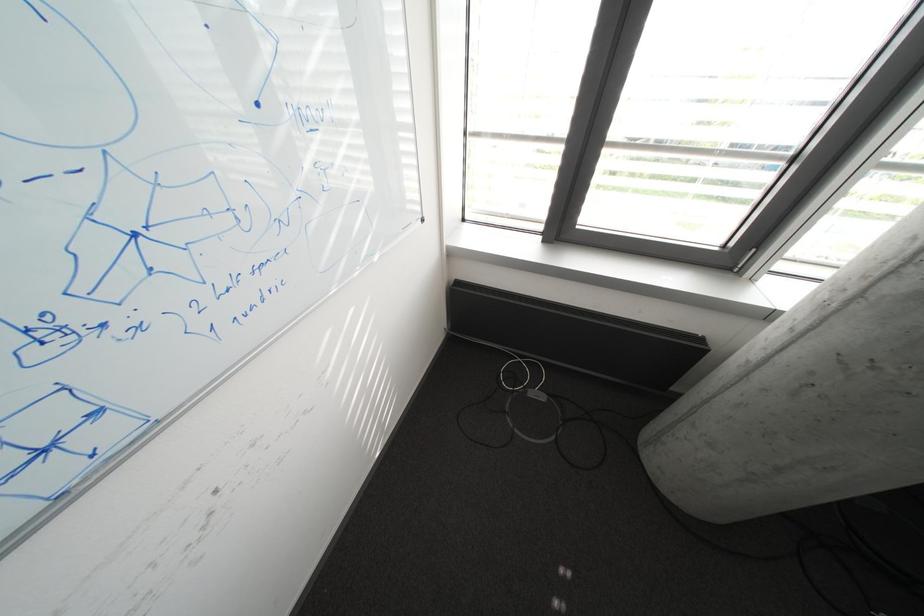
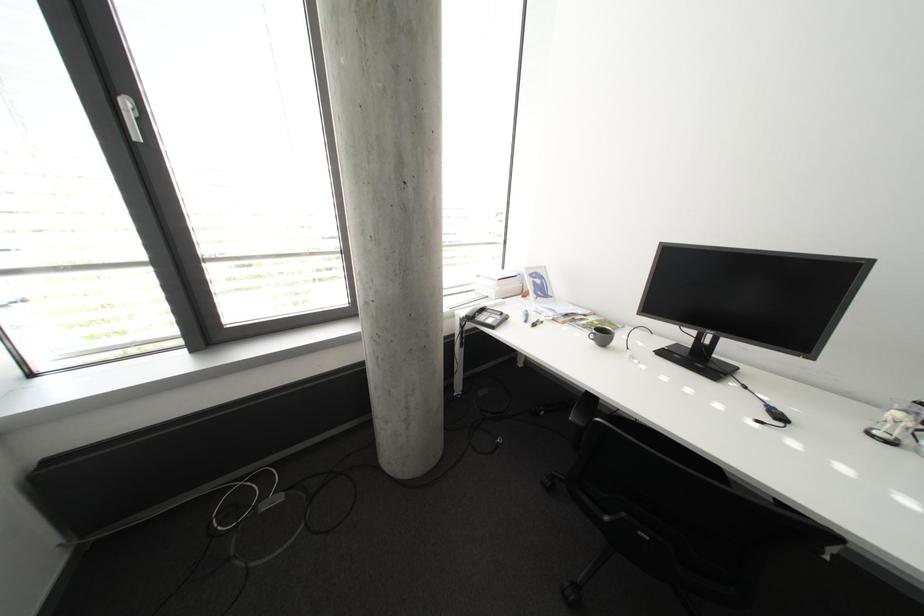
Question: The camera is either moving clockwise (left) or counter-clockwise (right) around the object. The first image is from the beginning of the video and the second image is from the end. Is the camera moving left or right when shooting the video?

Choices:
 (A) Left
 (B) Right

Answer: (A)